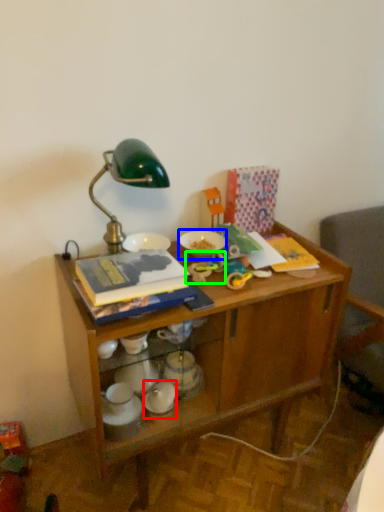
Question: Which object is positioned closest to tableware (highlighted by a red box)? Select from tableware (highlighted by a blue box) and toy (highlighted by a green box).

Choices:
 (A) tableware
 (B) toy

Answer: (B)